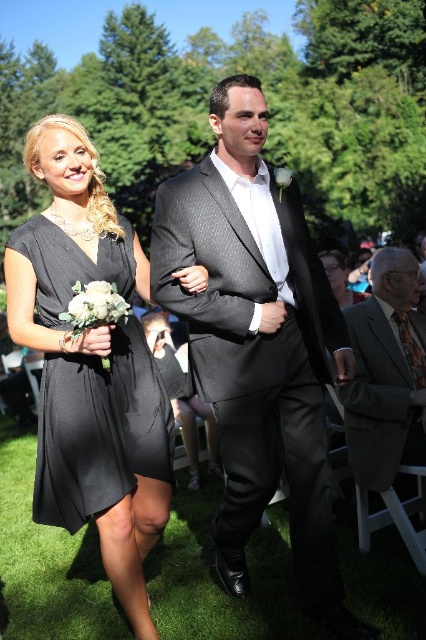
Question: Which of these objects is positioned closest to the matte black dress at lower center?

Choices:
 (A) black satin dress at center
 (B) charcoal textured suit at center
 (C) pinstriped suit at right

Answer: (C)

Question: Can you confirm if black satin dress at center is smaller than matte black dress at lower center?

Choices:
 (A) yes
 (B) no

Answer: (A)

Question: Which point is farther to the camera?

Choices:
 (A) (175, 225)
 (B) (115, 474)
 (C) (347, 412)
 (D) (322, 262)

Answer: (D)

Question: Does black satin dress at center have a smaller size compared to matte black dress at lower center?

Choices:
 (A) yes
 (B) no

Answer: (A)

Question: Which of the following is the closest to the observer?

Choices:
 (A) pinstriped suit at right
 (B) matte black dress at lower center
 (C) black satin dress at center

Answer: (C)

Question: Is charcoal textured suit at center to the right of pinstriped suit at right from the viewer's perspective?

Choices:
 (A) yes
 (B) no

Answer: (B)